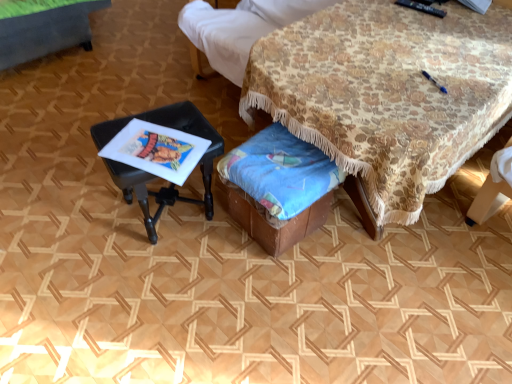
Find the location of a particular element. The height and width of the screenshot is (384, 512). vacant space underneath black plastic stool at left, arranged as the 1th table when viewed from the left (from a real-world perspective) is located at coordinates (173, 211).